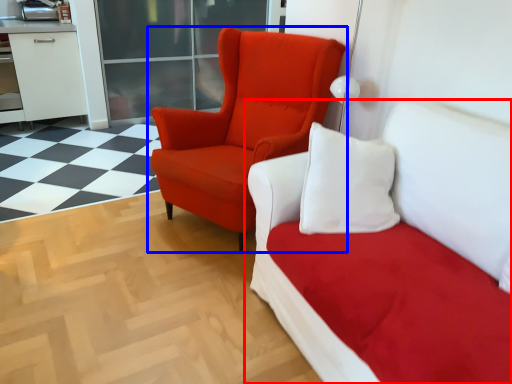
Question: Which of the following is the closest to the observer, studio couch (highlighted by a red box) or chair (highlighted by a blue box)?

Choices:
 (A) studio couch
 (B) chair

Answer: (A)